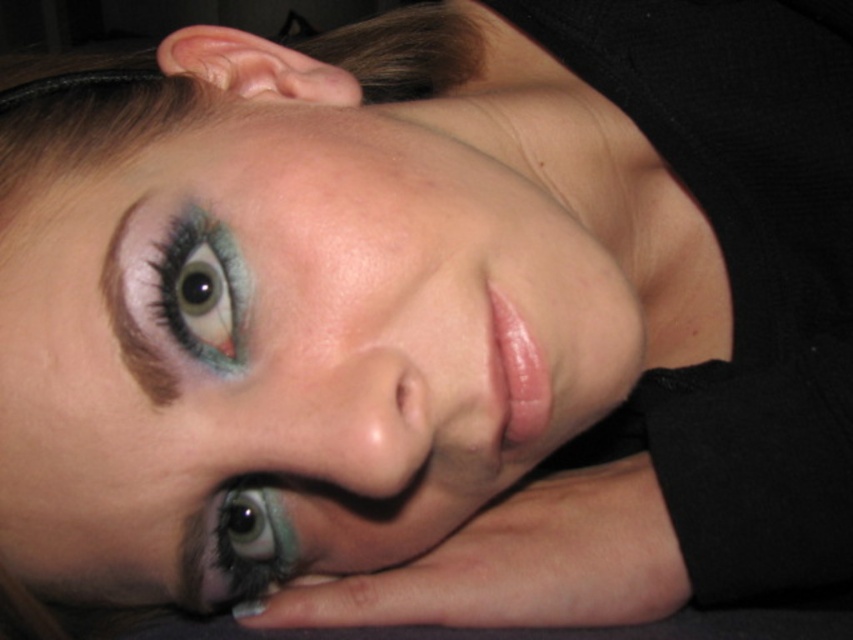
You are a photographer adjusting the focus of your camera. The camera is currently focused on the background. To ensure the smooth skin face at center is in focus, where should you adjust the focus point to?

The smooth skin face at center is located at point (294,342), so you should adjust the focus point to that coordinate to ensure it is in focus.

You are a photographer adjusting the lighting for a portrait. You notice the smooth skin face at center and the shiny blue eye at lower left in your frame. Which object should you focus on to highlight the subject in the foreground?

The smooth skin face at center should be focused on because it is positioned on the right side of the shiny blue eye at lower left, making it the main subject in the foreground.